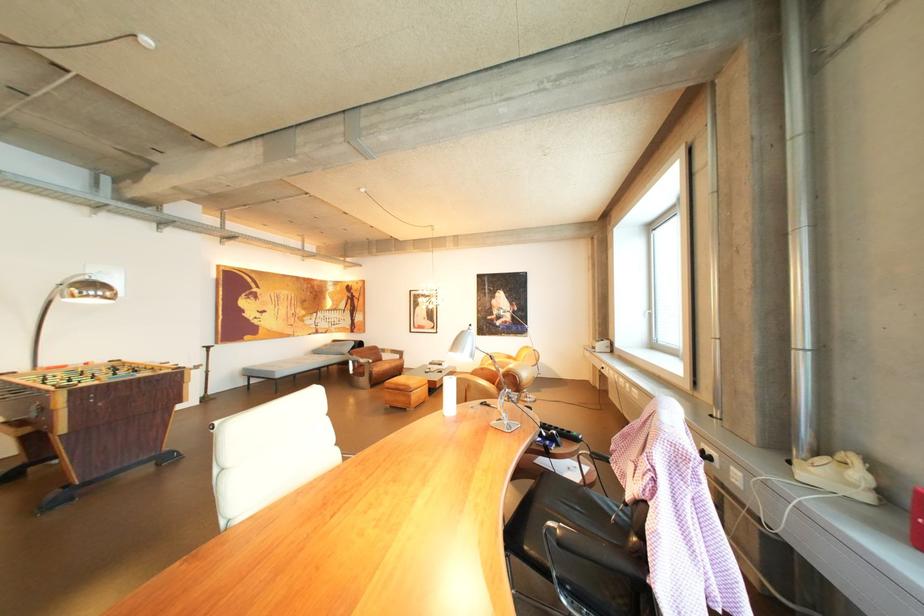
Find where to adjust the silver lamp head. Please return your answer as a coordinate pair (x, y).

(464, 344)